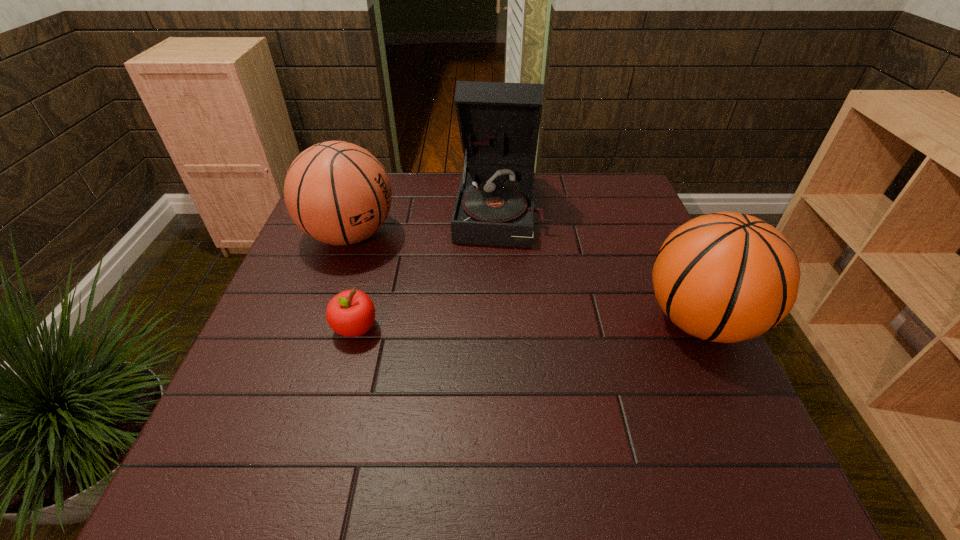
You are a GUI agent. You are given a task and a screenshot of the screen. Output one action in this format:
    pyautogui.click(x=<x>, y=<y>)
    Task: Click on the vacant space on the desktop that is between the shortest object and the right basketball and is positioned on the front-facing side of the phonograph_record
    
    Given the screenshot: What is the action you would take?
    pyautogui.click(x=489, y=325)

You are a GUI agent. You are given a task and a screenshot of the screen. Output one action in this format:
    pyautogui.click(x=<x>, y=<y>)
    Task: Click on the vacant space on the desktop that is between the apple and the nearer basketball and is positioned on the surface of the left basketball near the brand logo
    
    Given the screenshot: What is the action you would take?
    pyautogui.click(x=566, y=323)